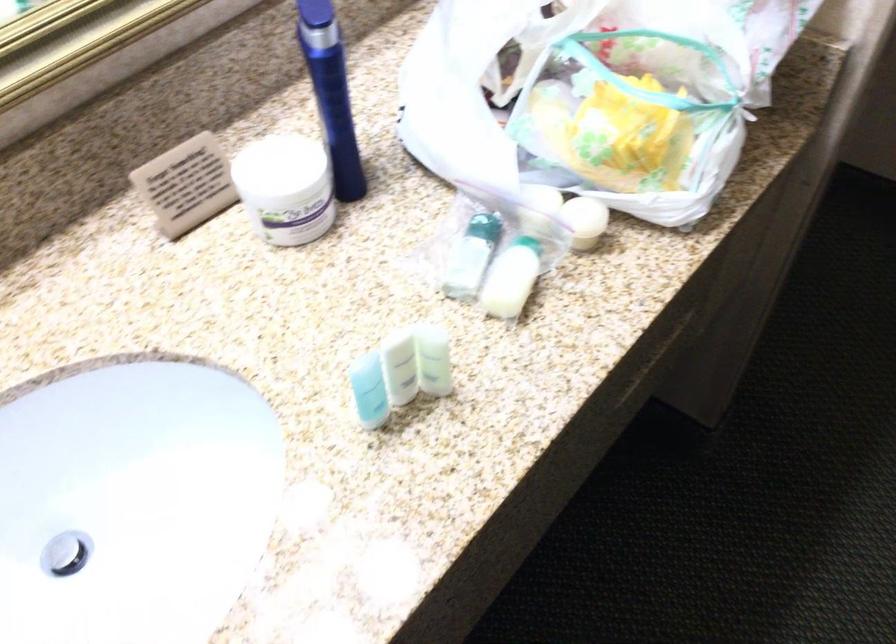
You are a GUI agent. You are given a task and a screenshot of the screen. Output one action in this format:
    pyautogui.click(x=<x>, y=<y>)
    Task: Click on the small green bottle
    
    Given the screenshot: What is the action you would take?
    pyautogui.click(x=400, y=368)